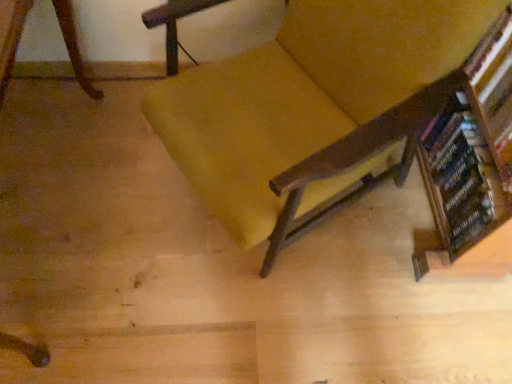
Question: From the image's perspective, is wooden bookshelf at right positioned above or below velvet yellow chair at center?

Choices:
 (A) above
 (B) below

Answer: (A)

Question: In terms of size, does wooden bookshelf at right appear bigger or smaller than velvet yellow chair at center?

Choices:
 (A) big
 (B) small

Answer: (B)

Question: Considering the real-world distances, which object is farthest from the wooden bookcase at right?

Choices:
 (A) velvet yellow chair at center
 (B) wooden bookshelf at right

Answer: (A)

Question: Which of these objects is positioned farthest from the velvet yellow chair at center?

Choices:
 (A) wooden bookshelf at right
 (B) wooden bookcase at right

Answer: (A)